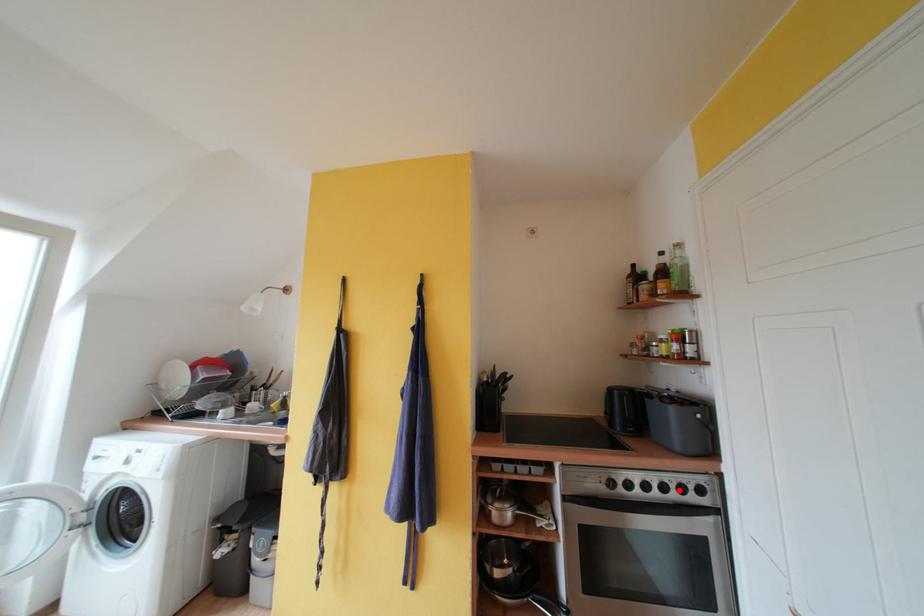
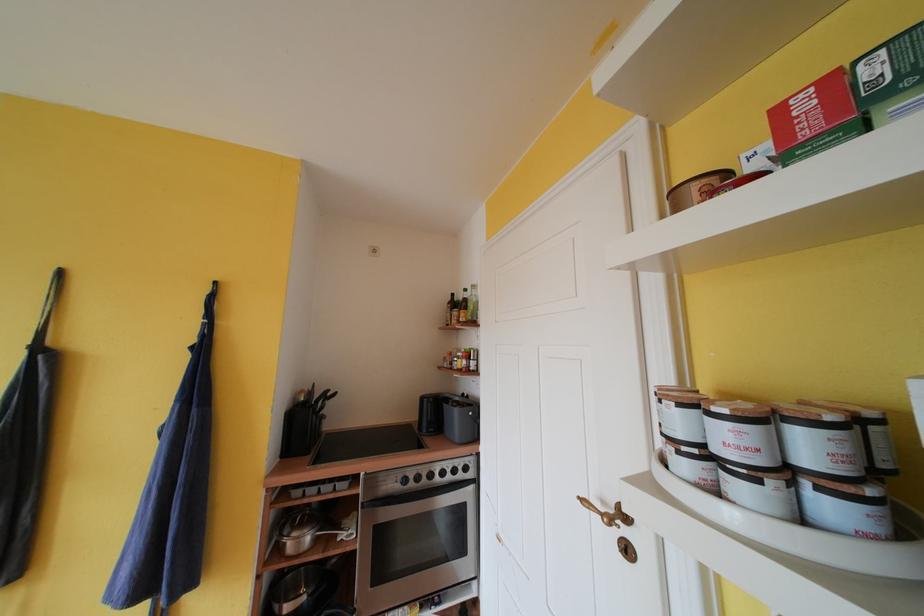
Locate, in the second image, the point that corresponds to the highlighted location in the first image.

(455, 474)